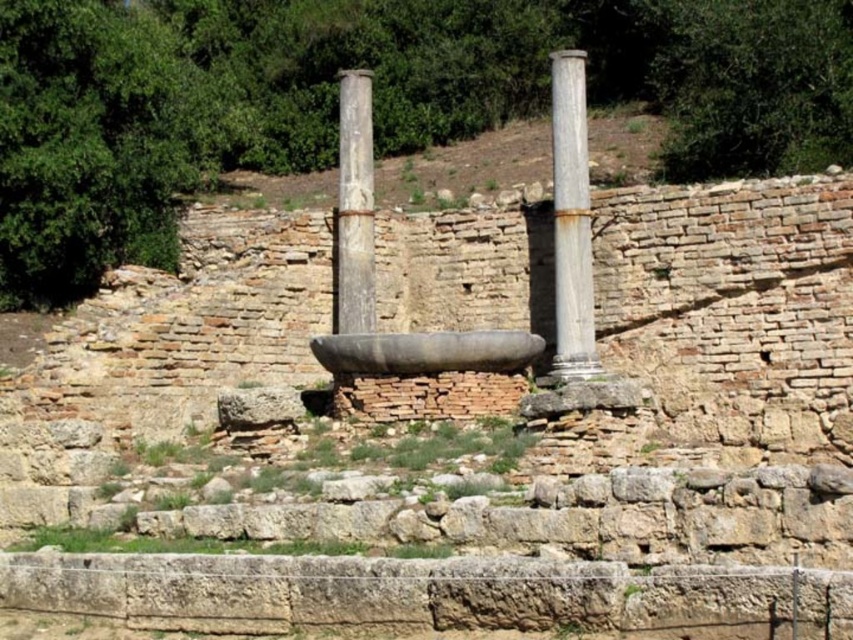
Question: Observing the image, what is the correct spatial positioning of rusty metallic column at right in reference to smooth stone column at center?

Choices:
 (A) below
 (B) above

Answer: (A)

Question: Which object is closer to the camera taking this photo?

Choices:
 (A) rusty metallic column at right
 (B) smooth stone column at center

Answer: (A)

Question: Among these objects, which one is farthest from the camera?

Choices:
 (A) smooth stone column at center
 (B) rusty metallic column at right

Answer: (A)

Question: Is the position of rusty metallic column at right more distant than that of smooth stone column at center?

Choices:
 (A) yes
 (B) no

Answer: (B)

Question: Observing the image, what is the correct spatial positioning of rusty metallic column at right in reference to smooth stone column at center?

Choices:
 (A) left
 (B) right

Answer: (B)